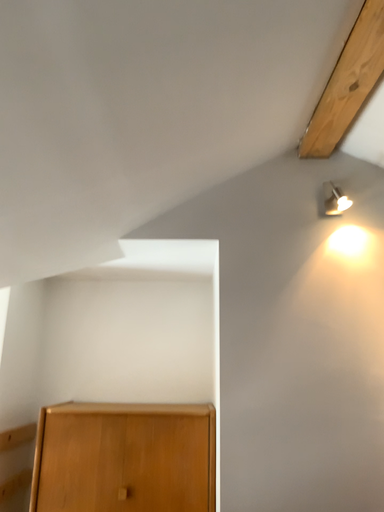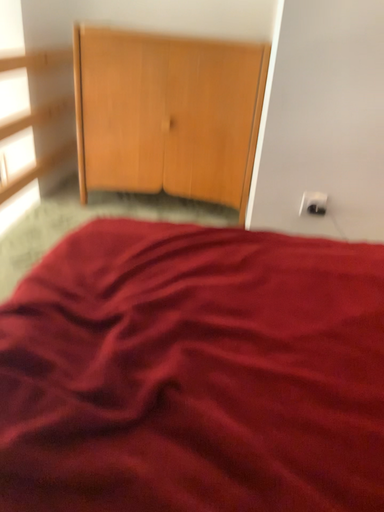
Question: How did the camera likely rotate when shooting the video?

Choices:
 (A) rotated left
 (B) rotated right

Answer: (A)